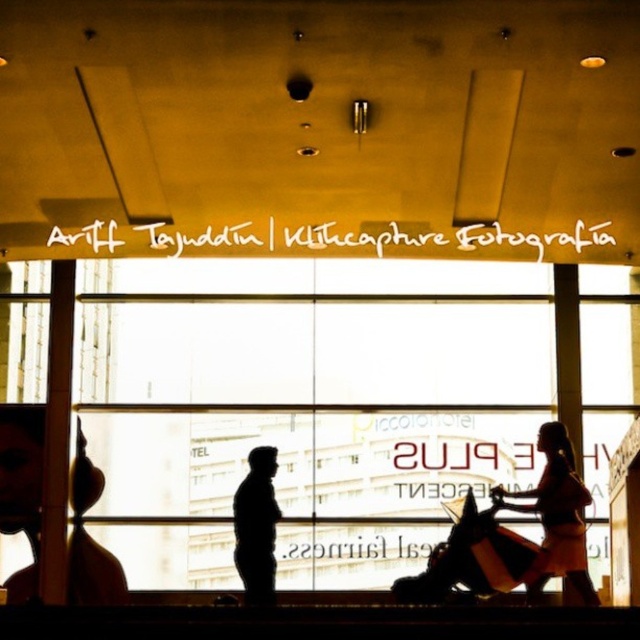
Question: Based on their relative distances, which object is nearer to the matte black baby carriage at lower center?

Choices:
 (A) black matte figure at center
 (B) silhouette dress at center

Answer: (B)

Question: Does matte black baby carriage at lower center have a lesser width compared to black matte figure at center?

Choices:
 (A) yes
 (B) no

Answer: (A)

Question: In this image, where is silhouette dress at center located relative to black matte figure at center?

Choices:
 (A) right
 (B) left

Answer: (A)

Question: Among these objects, which one is nearest to the camera?

Choices:
 (A) black matte figure at center
 (B) silhouette dress at center

Answer: (A)

Question: Which point appears farthest from the camera in this image?

Choices:
 (A) (474, 560)
 (B) (536, 493)

Answer: (B)

Question: Is matte black baby carriage at lower center above silhouette dress at center?

Choices:
 (A) yes
 (B) no

Answer: (A)